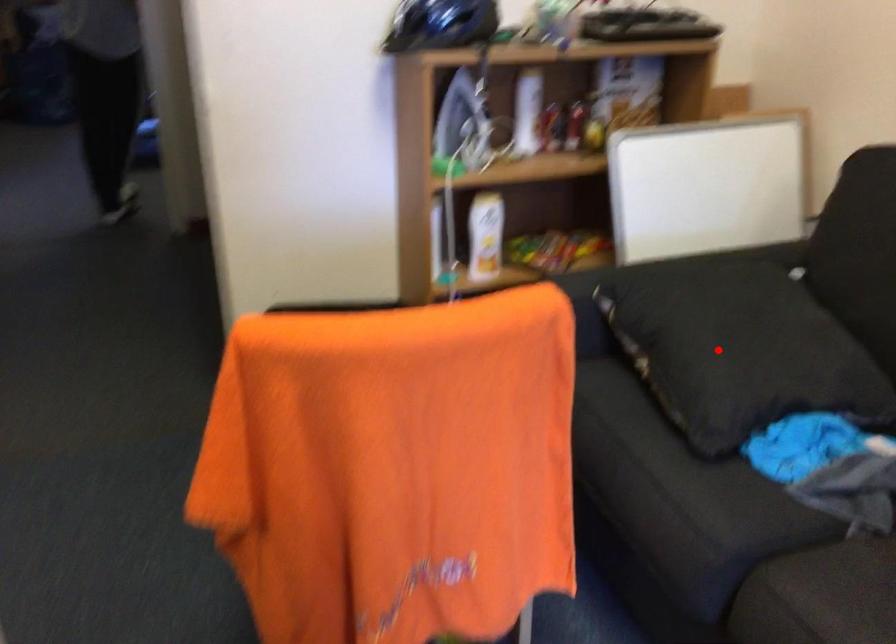
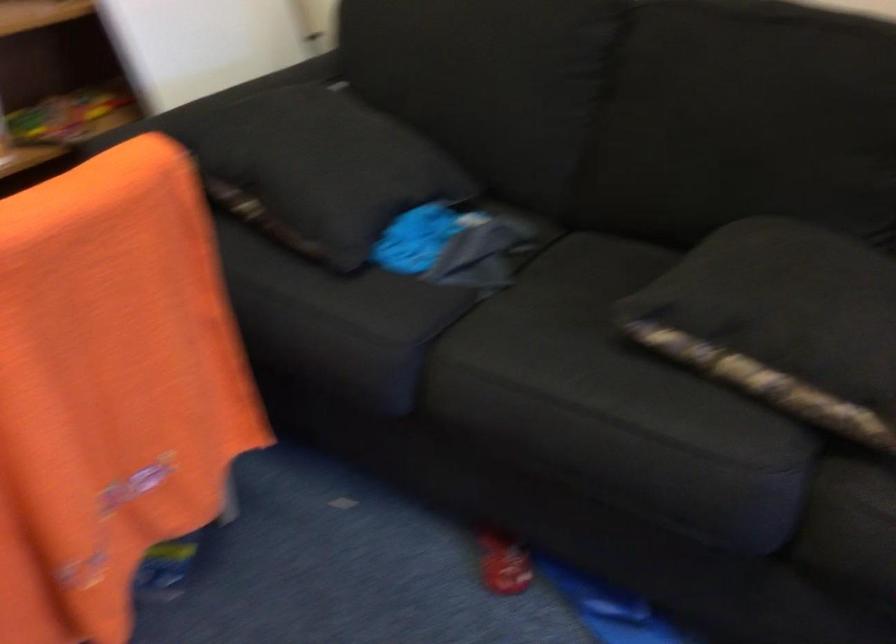
Where in the second image is the point corresponding to the highlighted location from the first image?

(321, 169)